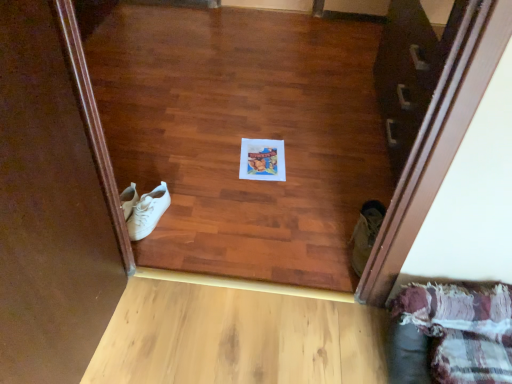
Question: Is tan suede boot at lower right, the second footwear positioned from the left, facing towards white leather sneakers at left, acting as the 2th footwear starting from the right?

Choices:
 (A) yes
 (B) no

Answer: (B)

Question: Considering the relative sizes of tan suede boot at lower right, the second footwear positioned from the left, and white leather sneakers at left, acting as the 2th footwear starting from the right, in the image provided, is tan suede boot at lower right, the second footwear positioned from the left, bigger than white leather sneakers at left, acting as the 2th footwear starting from the right,?

Choices:
 (A) no
 (B) yes

Answer: (B)

Question: Is tan suede boot at lower right, the second footwear positioned from the left, positioned with its back to white leather sneakers at left, placed as the 1th footwear when sorted from left to right?

Choices:
 (A) yes
 (B) no

Answer: (B)

Question: Is tan suede boot at lower right, arranged as the first footwear when viewed from the right, far away from white leather sneakers at left, placed as the 1th footwear when sorted from left to right?

Choices:
 (A) no
 (B) yes

Answer: (A)

Question: Is tan suede boot at lower right, the second footwear positioned from the left, not within white leather sneakers at left, acting as the 2th footwear starting from the right?

Choices:
 (A) no
 (B) yes

Answer: (B)

Question: Does tan suede boot at lower right, the second footwear positioned from the left, appear on the right side of white leather sneakers at left, placed as the 1th footwear when sorted from left to right?

Choices:
 (A) yes
 (B) no

Answer: (A)

Question: Can we say white leather sneakers at left, placed as the 1th footwear when sorted from left to right, lies outside tan suede boot at lower right, arranged as the first footwear when viewed from the right?

Choices:
 (A) no
 (B) yes

Answer: (B)

Question: Is the depth of white leather sneakers at left, acting as the 2th footwear starting from the right, less than that of tan suede boot at lower right, the second footwear positioned from the left?

Choices:
 (A) no
 (B) yes

Answer: (A)

Question: Does white leather sneakers at left, placed as the 1th footwear when sorted from left to right, have a greater width compared to tan suede boot at lower right, arranged as the first footwear when viewed from the right?

Choices:
 (A) yes
 (B) no

Answer: (A)

Question: Does white leather sneakers at left, placed as the 1th footwear when sorted from left to right, appear on the left side of tan suede boot at lower right, the second footwear positioned from the left?

Choices:
 (A) yes
 (B) no

Answer: (A)

Question: Does white leather sneakers at left, placed as the 1th footwear when sorted from left to right, have a lesser height compared to tan suede boot at lower right, arranged as the first footwear when viewed from the right?

Choices:
 (A) no
 (B) yes

Answer: (B)

Question: Are white leather sneakers at left, placed as the 1th footwear when sorted from left to right, and tan suede boot at lower right, the second footwear positioned from the left, making contact?

Choices:
 (A) no
 (B) yes

Answer: (A)

Question: Is the surface of light wood plank at lower center in direct contact with plaid fabric couch at lower right?

Choices:
 (A) no
 (B) yes

Answer: (A)